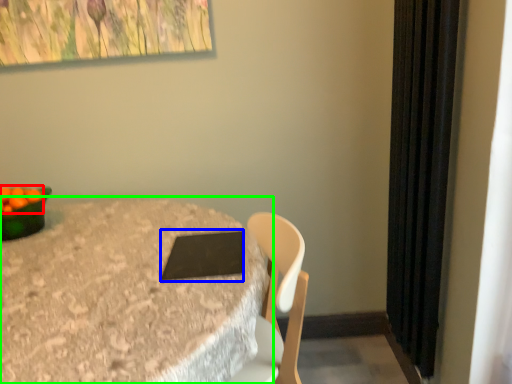
Question: Based on their relative distances, which object is nearer to fruit (highlighted by a red box)? Choose from pad (highlighted by a blue box) and table (highlighted by a green box).

Choices:
 (A) pad
 (B) table

Answer: (B)